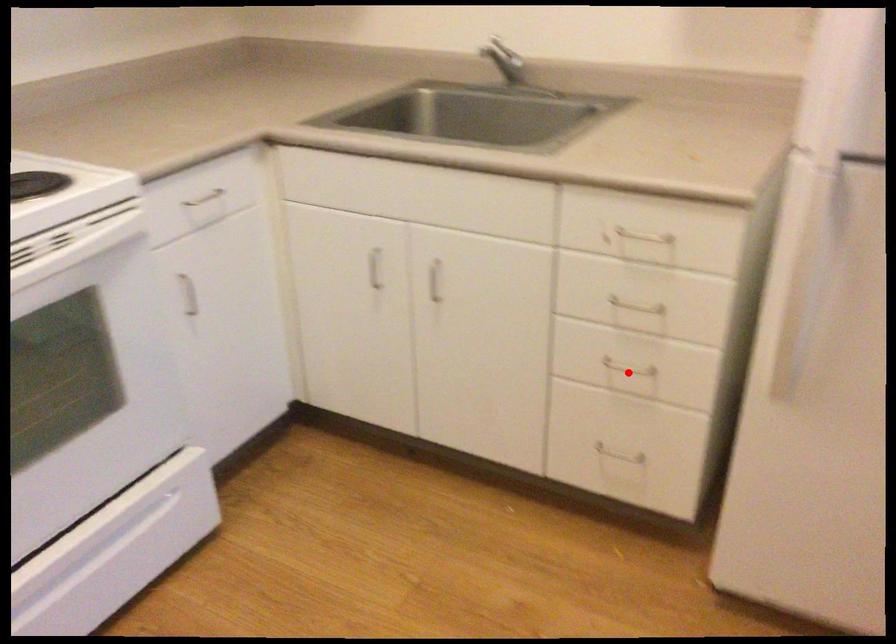
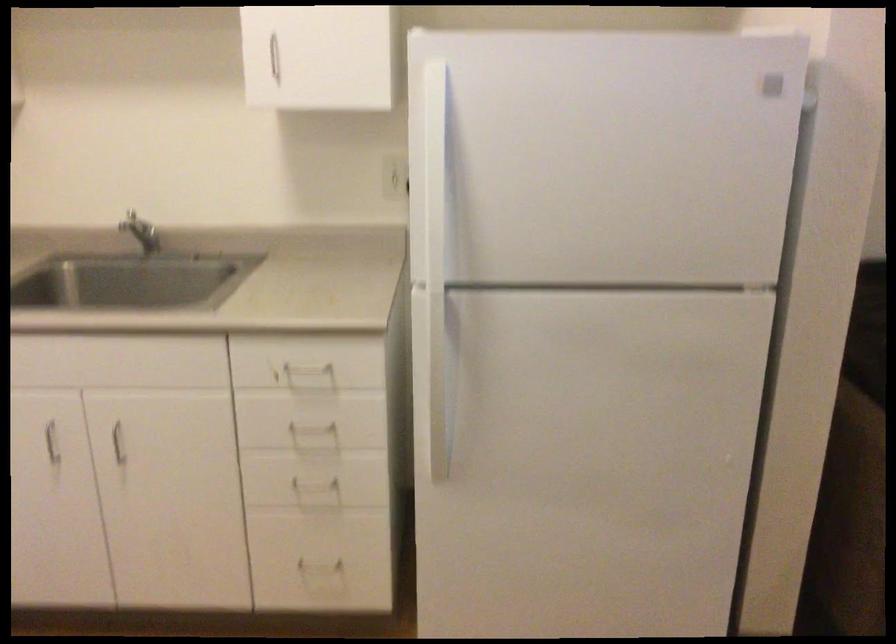
In the second image, find the point that corresponds to the highlighted location in the first image.

(319, 486)